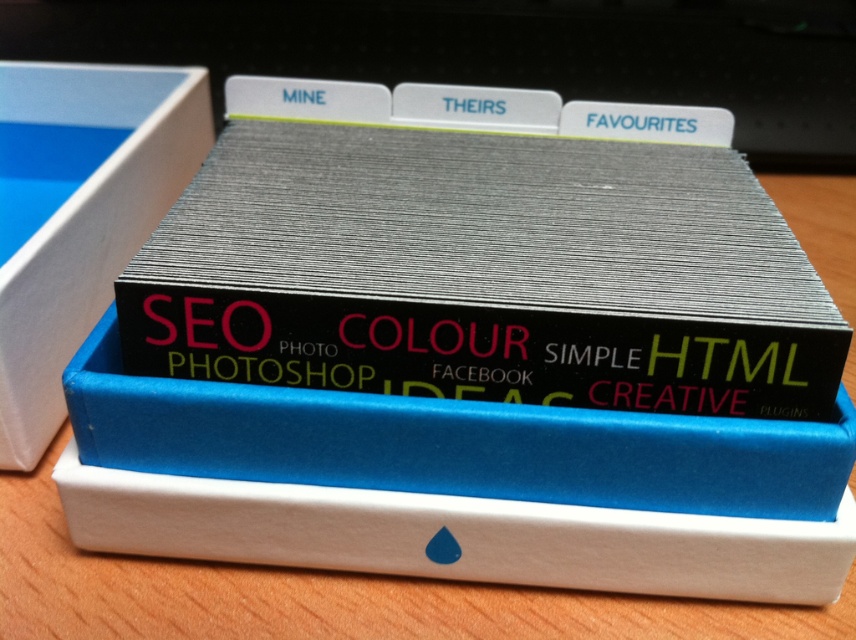
You are organizing your desk and see the metallic silver book at center and the white cardboard box at left. Which object is closer to you?

The metallic silver book at center is closer to you because it is positioned under the white cardboard box at left, meaning it is lower in the visual hierarchy and thus nearer in perspective.

You are organizing your desk and need to place a new metallic silver book at center and a white cardboard box at left. Based on the current setup, where should you position them to maintain the existing arrangement?

You should place the metallic silver book at center to the right of the white cardboard box at left to maintain the existing arrangement.

You are organizing your desk and see the metallic silver book at center and the white cardboard box at left. Which item is closer to you?

The metallic silver book at center is closer to you because it is in front of the white cardboard box at left.